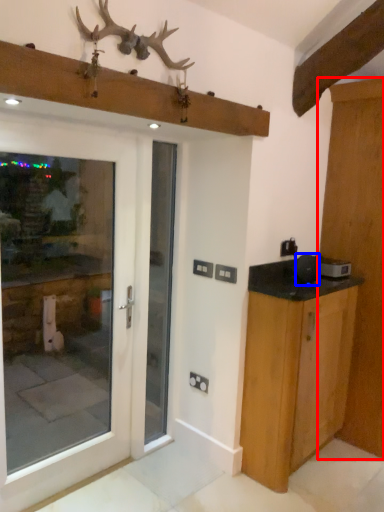
Question: Which of the following is the closest to the observer, door (highlighted by a red box) or appliance (highlighted by a blue box)?

Choices:
 (A) door
 (B) appliance

Answer: (A)